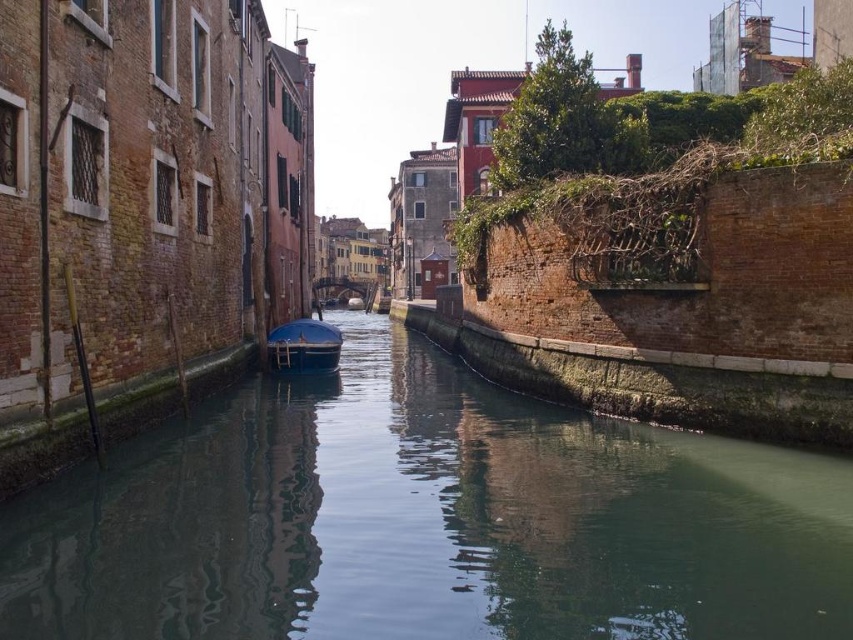
Question: Is green smooth water at center to the left of matte blue boat at center from the viewer's perspective?

Choices:
 (A) yes
 (B) no

Answer: (B)

Question: Which point is farther to the camera?

Choices:
 (A) green smooth water at center
 (B) matte blue boat at center

Answer: (B)

Question: Is green smooth water at center positioned at the back of matte blue boat at center?

Choices:
 (A) no
 (B) yes

Answer: (A)

Question: Observing the image, what is the correct spatial positioning of green smooth water at center in reference to matte blue boat at center?

Choices:
 (A) left
 (B) right

Answer: (B)

Question: Which point is closer to the camera?

Choices:
 (A) (316, 348)
 (B) (440, 512)

Answer: (B)

Question: Among these points, which one is nearest to the camera?

Choices:
 (A) (289, 557)
 (B) (268, 365)

Answer: (A)